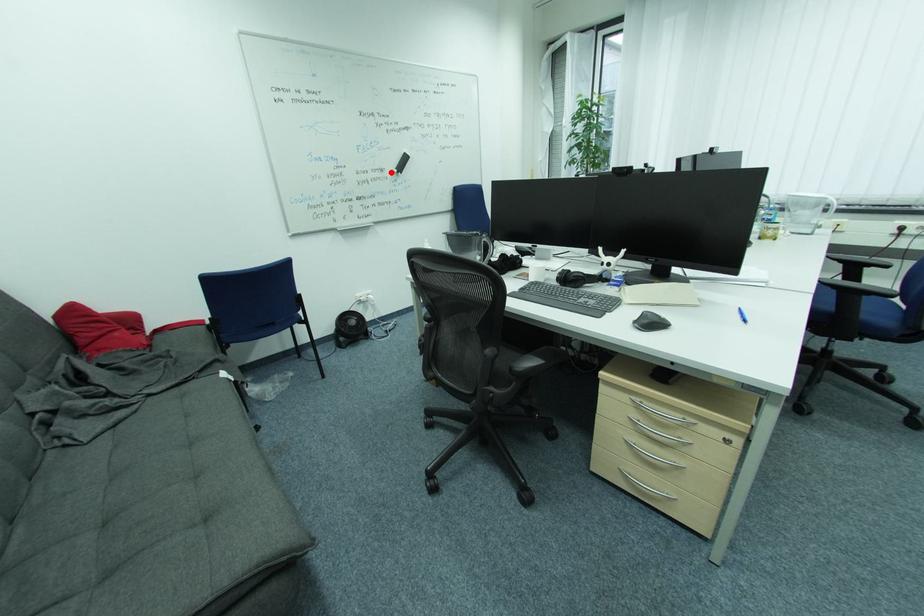
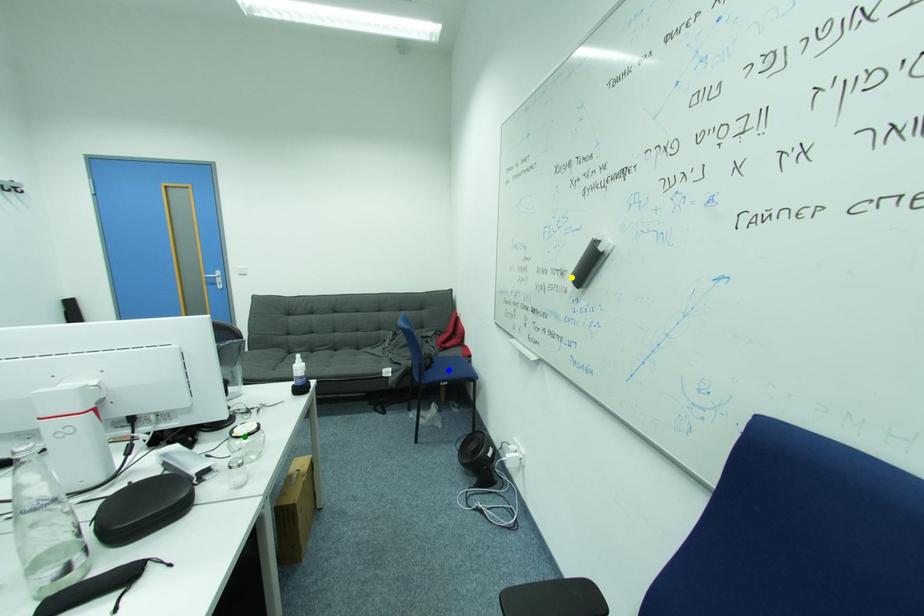
Question: I am providing you with two images of the same scene from different viewpoints. A red point is marked on the first image. You are given multiple points on the second image. In image 2, which mark is for the same physical point as the one in image 1?

Choices:
 (A) green point
 (B) yellow point
 (C) blue point

Answer: (B)